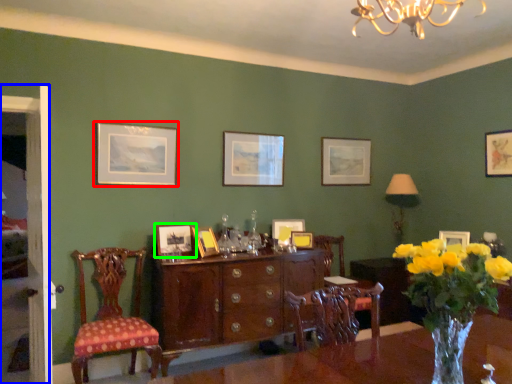
Question: Which is farther away from picture frame (highlighted by a red box)? side (highlighted by a blue box) or picture frame (highlighted by a green box)?

Choices:
 (A) side
 (B) picture frame

Answer: (A)